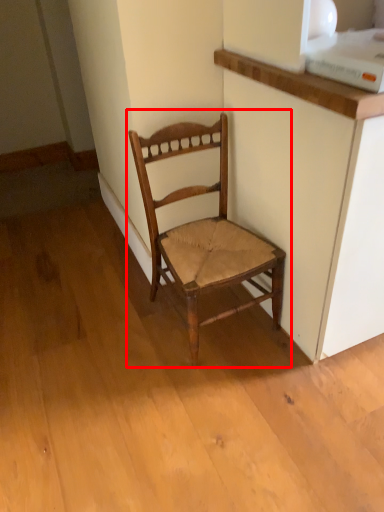
Question: From the image's perspective, where is chair (annotated by the red box) located in relation to cabinetry in the image?

Choices:
 (A) below
 (B) above

Answer: (A)